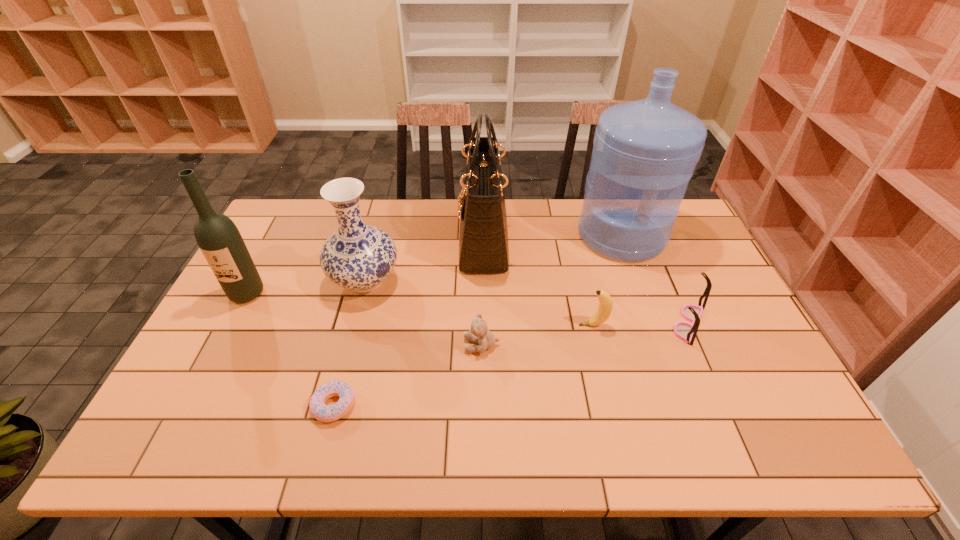
The image size is (960, 540). I want to click on vacant area at the far edge, so 541,213.

At what (x,y) coordinates should I click in order to perform the action: click on free spot at the near edge of the desktop. Please return your answer as a coordinate pair (x, y). Looking at the image, I should click on pyautogui.click(x=380, y=453).

Find the location of a particular element. Image resolution: width=960 pixels, height=540 pixels. free space at the left edge of the desktop is located at coordinates (230, 417).

Locate an element on the screen. The height and width of the screenshot is (540, 960). free space at the right edge of the desktop is located at coordinates (675, 245).

In the image, there is a desktop. What are the coordinates of `vacant space at the far left corner` in the screenshot? It's located at (286, 218).

Identify the location of blank area at the near left corner. (190, 451).

This screenshot has height=540, width=960. I want to click on empty space that is in between the nearest object and the spectacles, so click(512, 364).

Locate an element on the screen. blank region between the spectacles and the wine bottle is located at coordinates (468, 308).

Find the location of a particular element. This screenshot has height=540, width=960. vacant area between the wine bottle and the banana is located at coordinates pos(420,309).

Identify the location of free point between the water jug and the seventh tallest object. (551, 290).